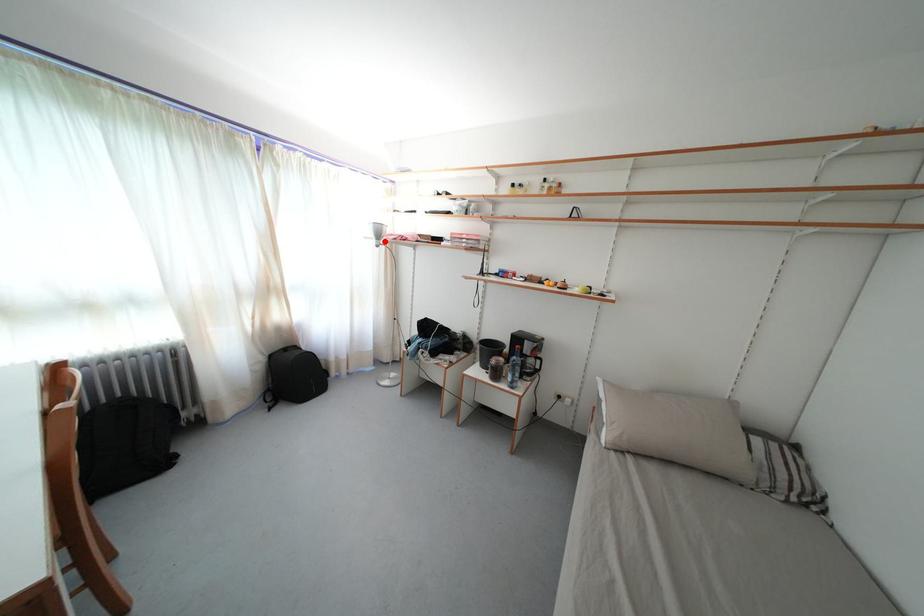
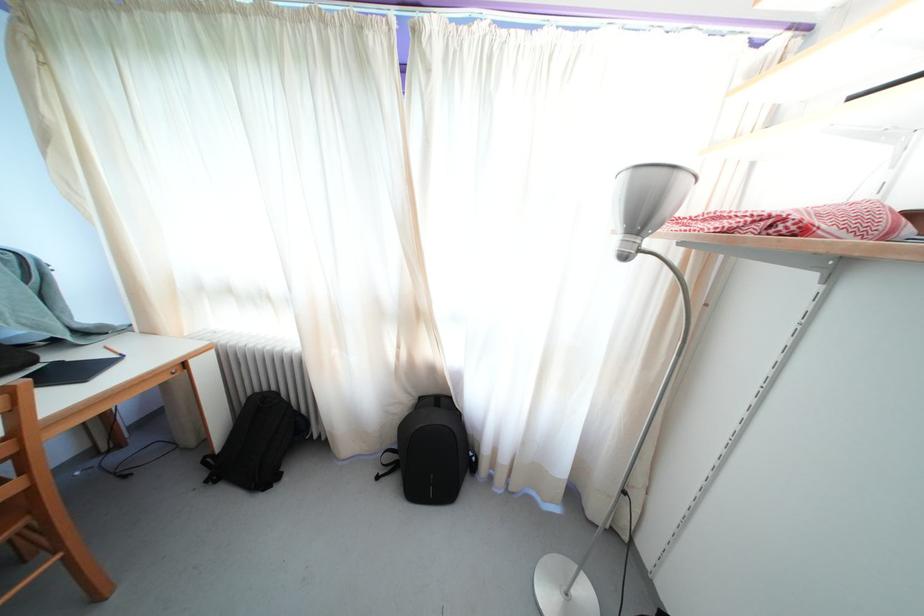
In the second image, find the point that corresponds to the highlighted location in the first image.

(648, 223)